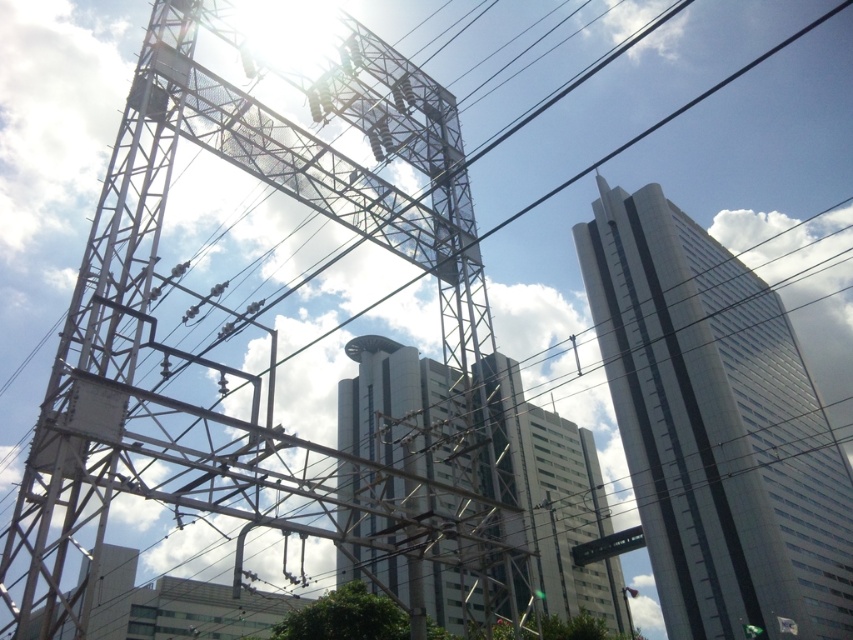
You are an urban planner assessing the skyline. Considering the silver metallic skyscraper at upper right and the glassy white skyscraper at center, which one has a greater width?

The silver metallic skyscraper at upper right has a greater width than the glassy white skyscraper at center.

You are a city planner analyzing the urban layout. You notice a point at coordinates (270, 342) in the image. What does this point indicate in the scene?

The point at coordinates (270, 342) marks the location of the metallic structure at left.

You are a city planner assessing the urban skyline. You need to determine if the metallic structure at left will block the view of the glassy white skyscraper at center from a nearby park. Based on their heights, what can you conclude?

The metallic structure at left is taller than the glassy white skyscraper at center, so it would likely block the view of the glassy white skyscraper at center from the park.